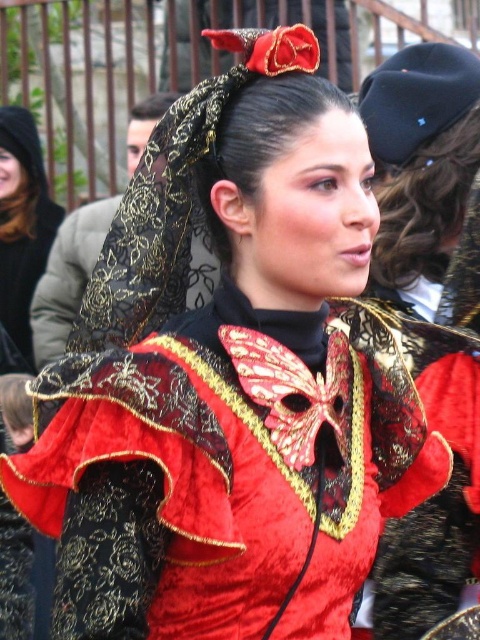
Question: Observing the image, what is the correct spatial positioning of black lace veil at upper center in reference to matte black veil at upper left?

Choices:
 (A) above
 (B) below

Answer: (A)

Question: Does black lace veil at upper center appear under matte black veil at upper left?

Choices:
 (A) no
 (B) yes

Answer: (A)

Question: Can you confirm if black lace veil at upper center is positioned to the right of matte black veil at upper left?

Choices:
 (A) yes
 (B) no

Answer: (A)

Question: Which of the following is the closest to the observer?

Choices:
 (A) matte black veil at upper left
 (B) black lace veil at upper center

Answer: (B)